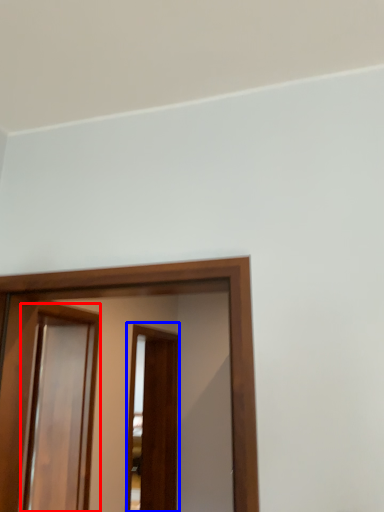
Question: Which point is further to the camera, screen door (highlighted by a red box) or screen door (highlighted by a blue box)?

Choices:
 (A) screen door
 (B) screen door

Answer: (B)